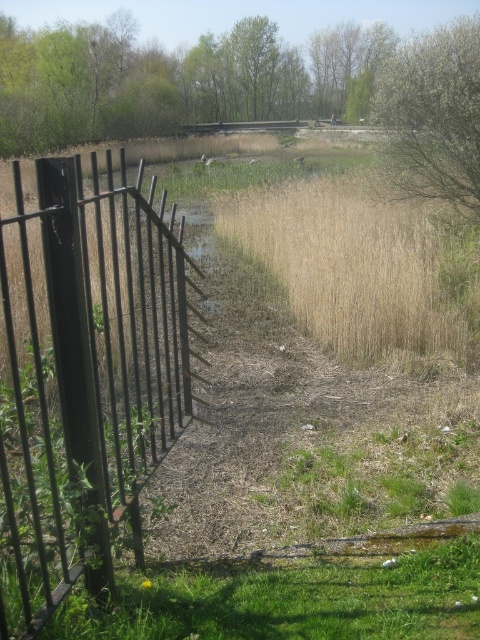
This screenshot has width=480, height=640. I want to click on black metal fence at left, so click(x=84, y=376).

Image resolution: width=480 pixels, height=640 pixels. I want to click on black metal fence at left, so click(x=84, y=376).

Identify the location of black metal fence at left. The width and height of the screenshot is (480, 640). (84, 376).